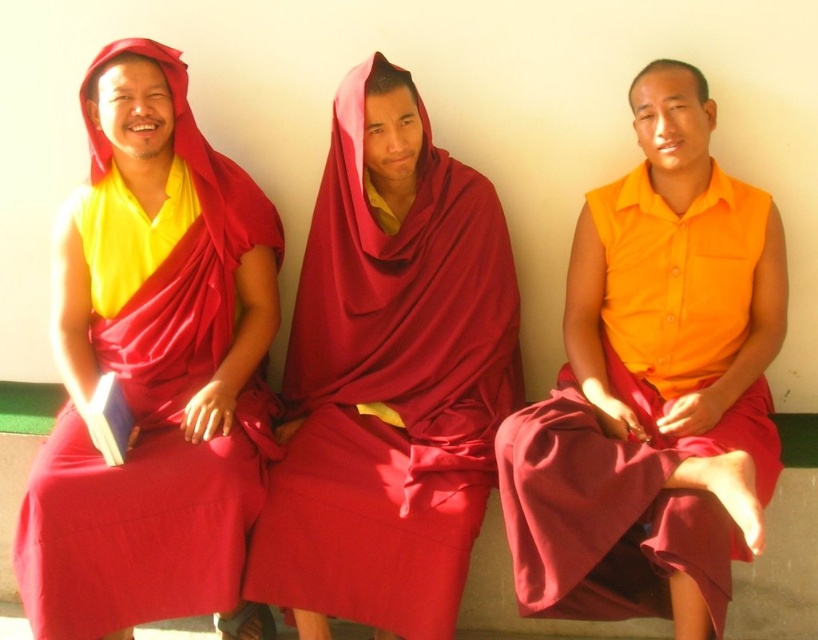
Based on the scene description, which object is wider between the orange matte vest at center and the maroon silk robe at center?

The orange matte vest at center is wider than the maroon silk robe at center according to the description.

You are standing in front of the image and want to know which of the two points, point (64, 509) or point (358, 172), is closer to you. Based on their positions in the image, can you determine which one is nearer?

Point (64, 509) is in front of point (358, 172), so it is closer to you.